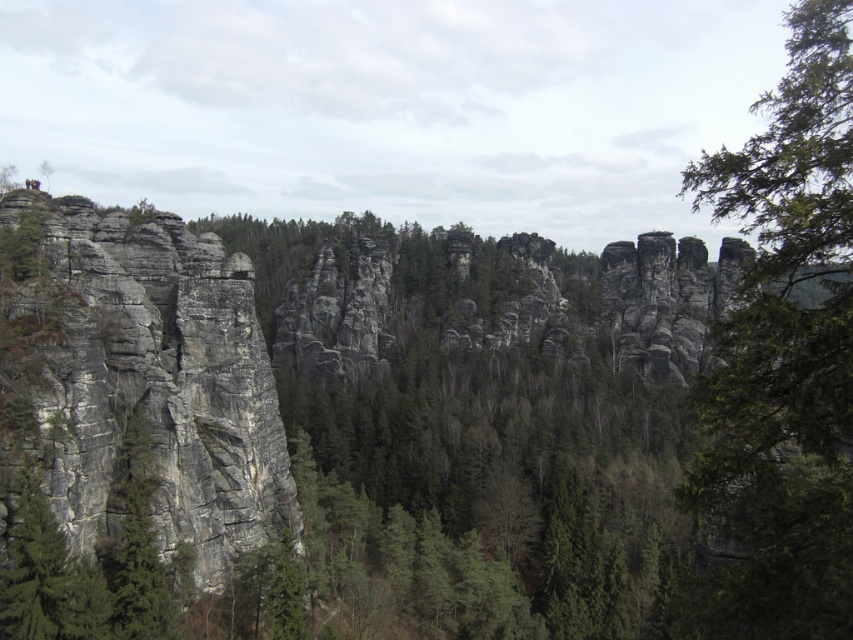
Is gray rough rock face at left thinner than green matte tree at upper left?

No, gray rough rock face at left is not thinner than green matte tree at upper left.

Is gray rough rock face at left to the right of green matte tree at upper left from the viewer's perspective?

Indeed, gray rough rock face at left is positioned on the right side of green matte tree at upper left.

What do you see at coordinates (154, 380) in the screenshot? This screenshot has width=853, height=640. I see `gray rough rock face at left` at bounding box center [154, 380].

At what (x,y) coordinates should I click in order to perform the action: click on gray rough rock face at left. Please return your answer as a coordinate pair (x, y). Looking at the image, I should click on (154, 380).

Is green leafy tree at right positioned before gray rough rock face at left?

Yes, green leafy tree at right is closer to the viewer.

What do you see at coordinates (785, 355) in the screenshot?
I see `green leafy tree at right` at bounding box center [785, 355].

Measure the distance between point (845, 269) and camera.

Point (845, 269) and camera are 34.36 meters apart.

Identify the location of green leafy tree at right. The image size is (853, 640). (785, 355).

How distant is green leafy tree at right from green matte tree at upper left?

The distance of green leafy tree at right from green matte tree at upper left is 275.51 meters.

Can you confirm if green leafy tree at right is positioned below green matte tree at upper left?

Correct, green leafy tree at right is located below green matte tree at upper left.

I want to click on green leafy tree at right, so click(785, 355).